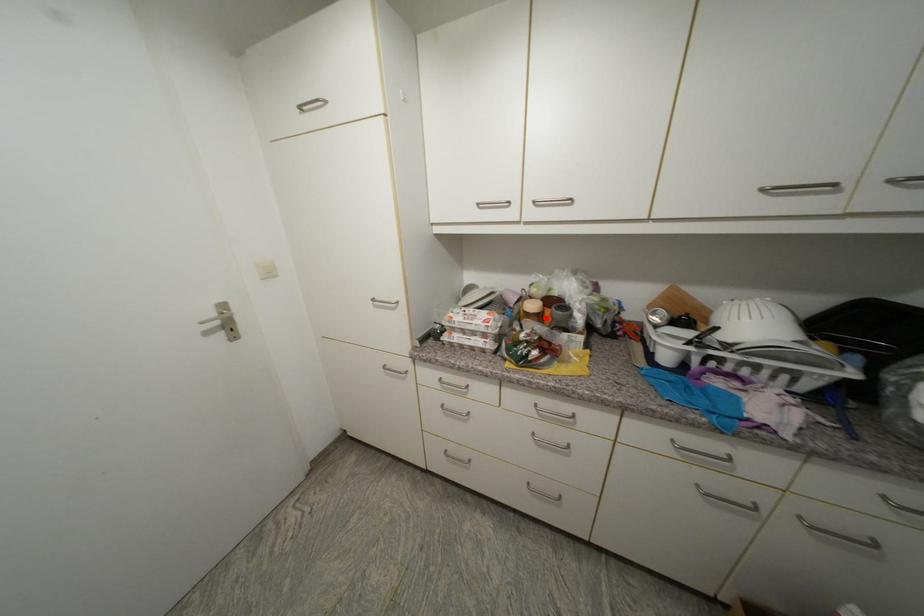
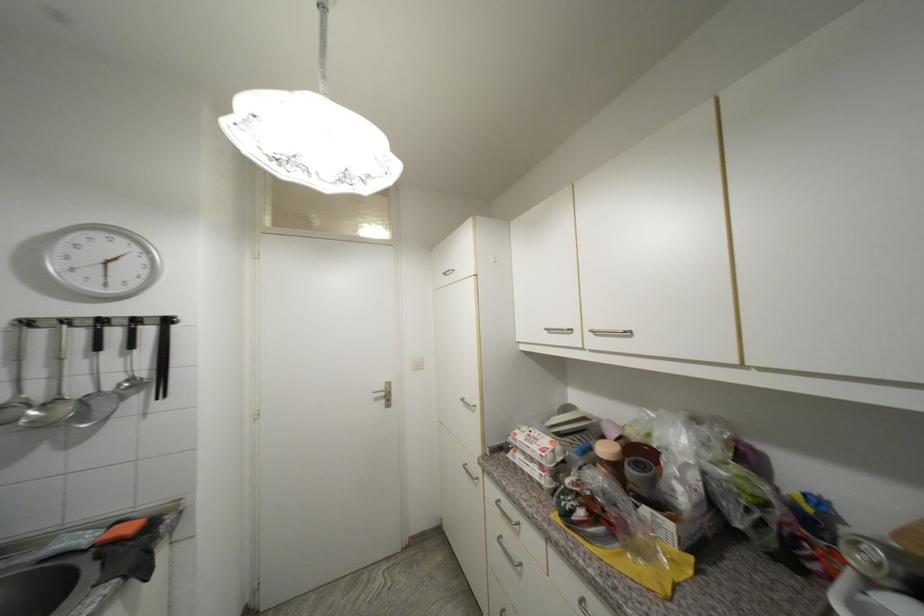
Find the pixel in the second image that matches the highlighted location in the first image.

(622, 469)